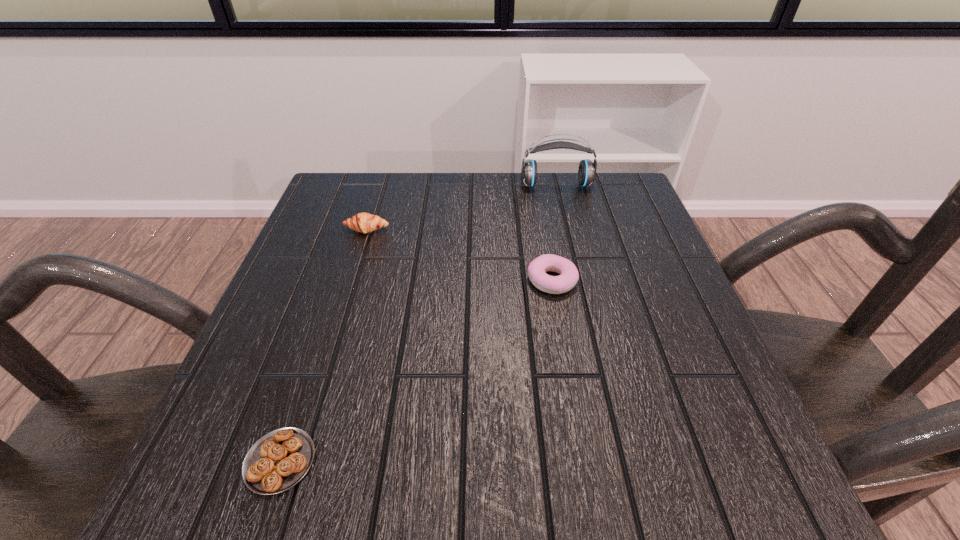
Identify the location of vacant point located on the back of the nearest pastry. (308, 377).

The width and height of the screenshot is (960, 540). What are the coordinates of `headset present at the far edge` in the screenshot? It's located at (587, 169).

The height and width of the screenshot is (540, 960). I want to click on pastry at the far edge, so click(x=362, y=222).

In order to click on object at the near edge in this screenshot , I will do `click(280, 459)`.

Where is `object that is at the right edge`? Image resolution: width=960 pixels, height=540 pixels. object that is at the right edge is located at coordinates pyautogui.click(x=587, y=169).

The height and width of the screenshot is (540, 960). Find the location of `object that is positioned at the far left corner`. object that is positioned at the far left corner is located at coordinates (362, 222).

The height and width of the screenshot is (540, 960). What are the coordinates of `object present at the near left corner` in the screenshot? It's located at (280, 459).

Find the location of a particular element. object that is at the far right corner is located at coordinates (587, 169).

Find the location of a particular element. vacant region at the far edge is located at coordinates (555, 190).

Where is `free space at the near edge`? The height and width of the screenshot is (540, 960). free space at the near edge is located at coordinates (501, 485).